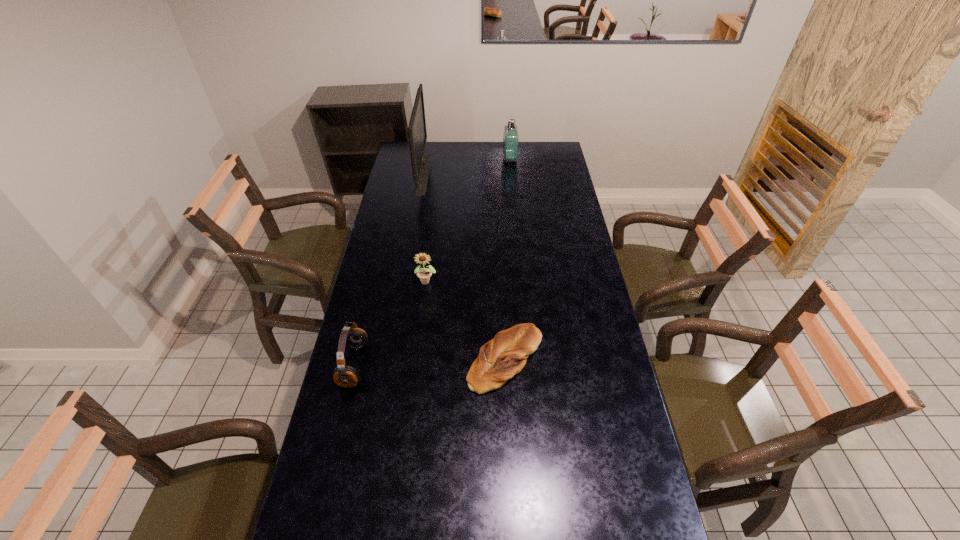
Locate an element on the screen. monitor is located at coordinates (417, 134).

Locate an element on the screen. This screenshot has height=540, width=960. the tallest object is located at coordinates (417, 134).

Where is `the fourth shortest object`? Image resolution: width=960 pixels, height=540 pixels. the fourth shortest object is located at coordinates pos(511,133).

Find the location of `the third farthest object`. the third farthest object is located at coordinates point(424,274).

The height and width of the screenshot is (540, 960). What are the coordinates of `sunflower` in the screenshot? It's located at click(424, 274).

This screenshot has height=540, width=960. What are the coordinates of `headset` in the screenshot? It's located at tap(356, 338).

This screenshot has height=540, width=960. I want to click on the shortest object, so [x=501, y=358].

You are a GUI agent. You are given a task and a screenshot of the screen. Output one action in this format:
    pyautogui.click(x=<x>, y=<y>)
    Task: Click on the free space located 0.380m on the front-facing side of the tallest object
    The width and height of the screenshot is (960, 540).
    Given the screenshot: What is the action you would take?
    pyautogui.click(x=502, y=174)

What are the coordinates of `free space located 0.270m on the front label of the second tallest object` in the screenshot? It's located at (453, 159).

Find the location of a particular element. The width and height of the screenshot is (960, 540). vacant area situated 0.250m on the front label of the second tallest object is located at coordinates (457, 159).